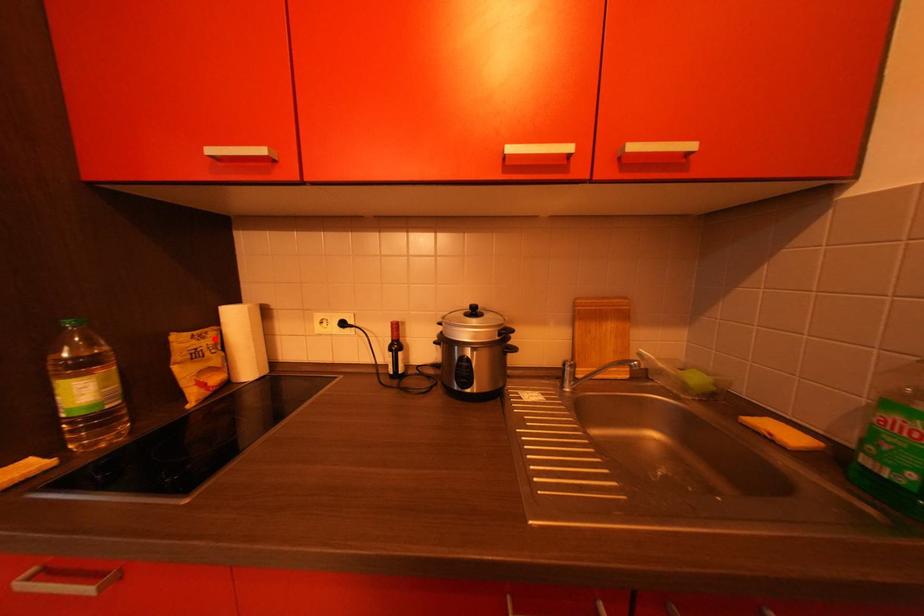
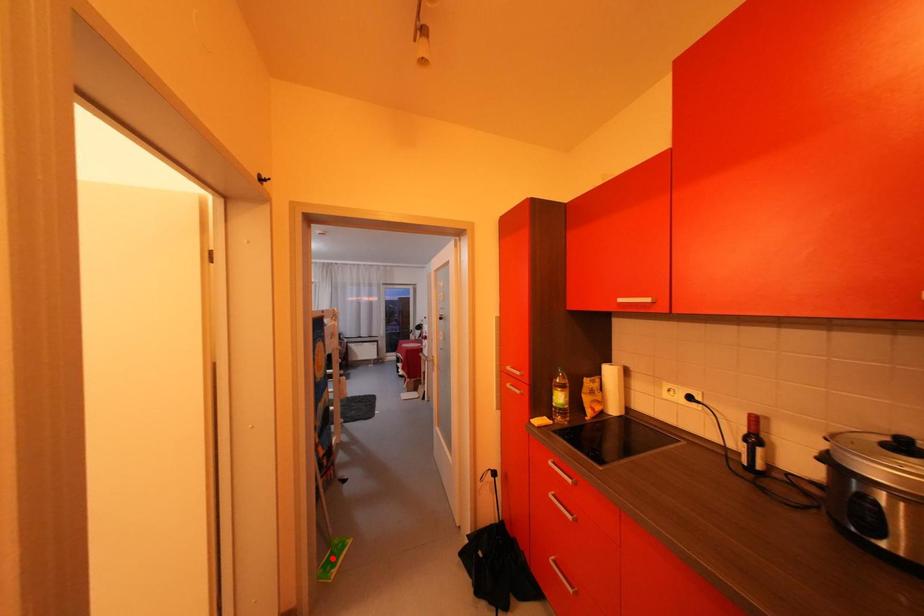
Looking at this image, I am providing you with two images of the same scene from different viewpoints. A red point is marked on the first image and another point is marked on the second image. Is the red point in image1 aligned with the point shown in image2?

No